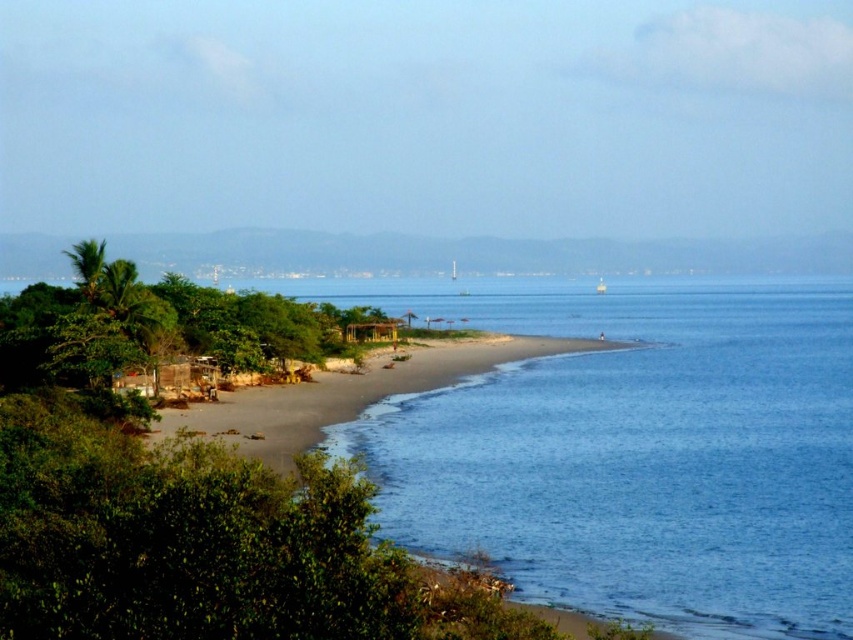
You are standing at the edge of a cliff overlooking the brown sandy beach at lower left. If you decide to walk down to the beach, how far will you have to walk?

The brown sandy beach at lower left is 208.44 feet away from the viewer, so you will have to walk approximately 208.44 feet to reach it.

You are standing on the brown sandy beach at lower left and want to reach the blue smooth water at center. Based on the scene description, which direction should you walk to get to the water?

The blue smooth water at center is much taller than the brown sandy beach at lower left, so you should walk towards the center from the lower left to reach the water.

You are standing on the beach and see the blue smooth water at center and the white plastic boat at center. Which one is closer to the left side of the beach?

The blue smooth water at center is to the left of the white plastic boat at center, so it is closer to the left side of the beach.